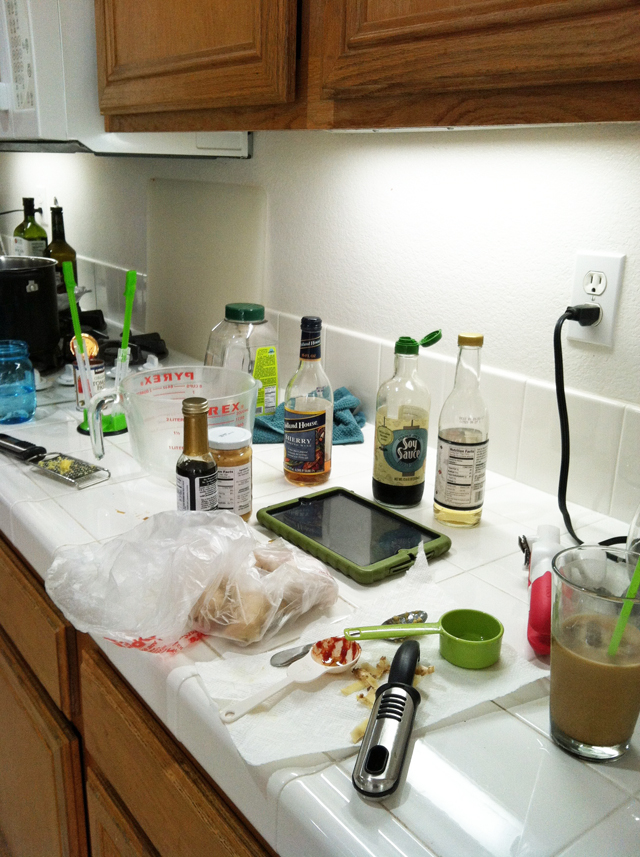
The height and width of the screenshot is (857, 640). I want to click on cutting board, so 216,238.